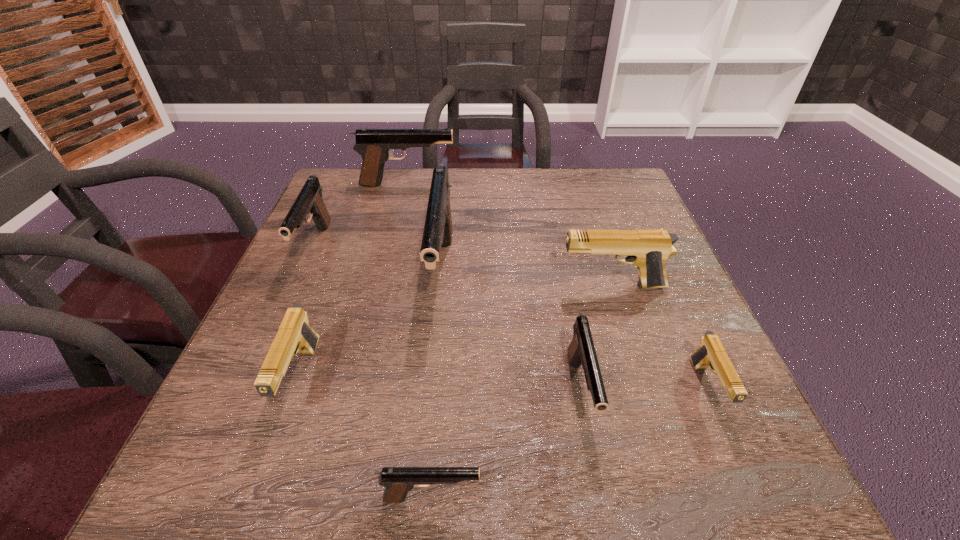
Locate an element on the screen. The width and height of the screenshot is (960, 540). object that is positioned at the far left corner is located at coordinates (374, 145).

At what (x,y) coordinates should I click in order to perform the action: click on free space at the far edge of the desktop. Please return your answer as a coordinate pair (x, y). Looking at the image, I should click on (420, 193).

Locate an element on the screen. vacant space at the left edge is located at coordinates (228, 417).

The height and width of the screenshot is (540, 960). What are the coordinates of `vacant space at the right edge of the desktop` in the screenshot? It's located at (640, 314).

Locate an element on the screen. vacant space at the far left corner of the desktop is located at coordinates click(343, 170).

The width and height of the screenshot is (960, 540). I want to click on vacant position at the near left corner of the desktop, so click(x=215, y=493).

This screenshot has width=960, height=540. Find the location of `vacant area at the far right corner`. vacant area at the far right corner is located at coordinates (588, 196).

Locate an element on the screen. free space between the farthest tan pistol and the second biggest tan pistol is located at coordinates (456, 333).

I want to click on empty space between the leftmost tan pistol and the biggest tan pistol, so click(456, 333).

You are a GUI agent. You are given a task and a screenshot of the screen. Output one action in this format:
    pyautogui.click(x=<x>, y=<y>)
    Task: Click on the vacant space that is in between the third biggest black pistol and the smallest tan pistol
    
    Given the screenshot: What is the action you would take?
    pyautogui.click(x=511, y=318)